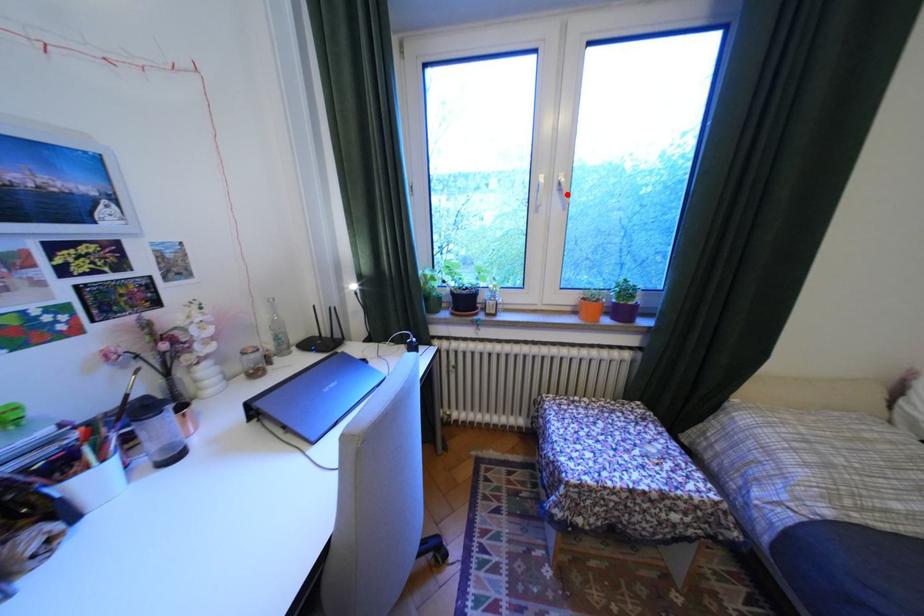
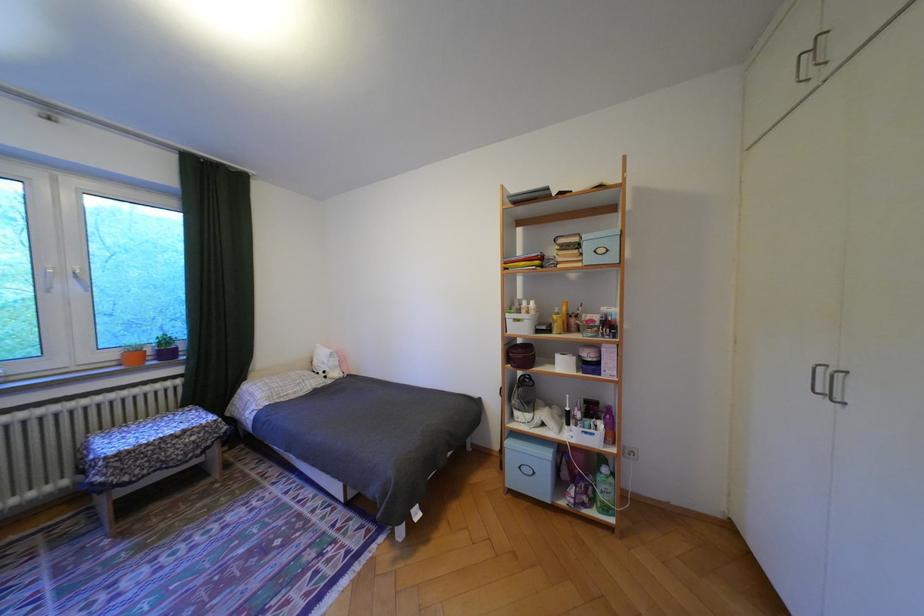
Locate, in the second image, the point that corresponds to the highlighted location in the first image.

(84, 280)